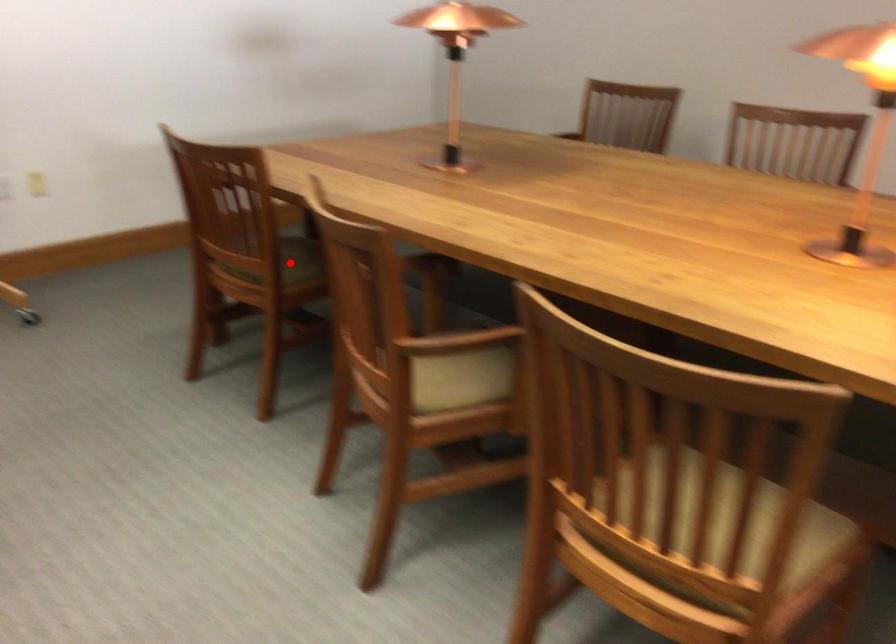
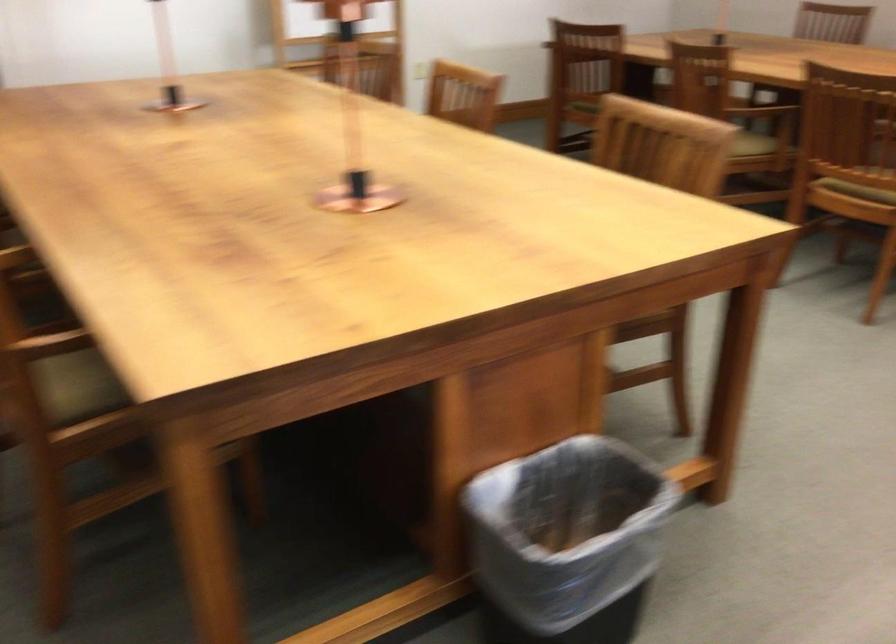
Question: I am providing you with two images of the same scene from different viewpoints. A red point is marked on the first image. Can you still see the location of the red point in image 2?

Choices:
 (A) Yes
 (B) No

Answer: (B)